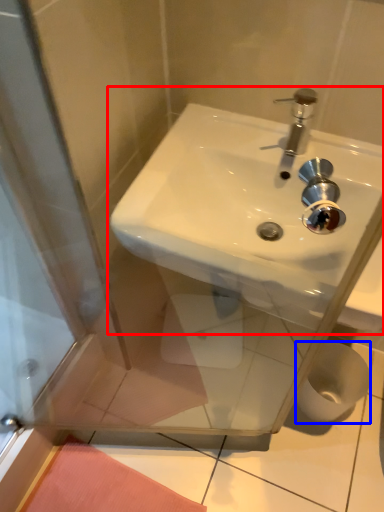
Question: Which object appears closest to the camera in this image, sink (highlighted by a red box) or toilet paper (highlighted by a blue box)?

Choices:
 (A) sink
 (B) toilet paper

Answer: (A)